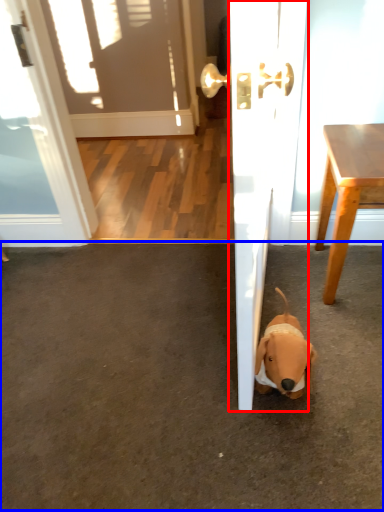
Question: Which object is further to the camera taking this photo, door (highlighted by a red box) or concrete (highlighted by a blue box)?

Choices:
 (A) door
 (B) concrete

Answer: (B)